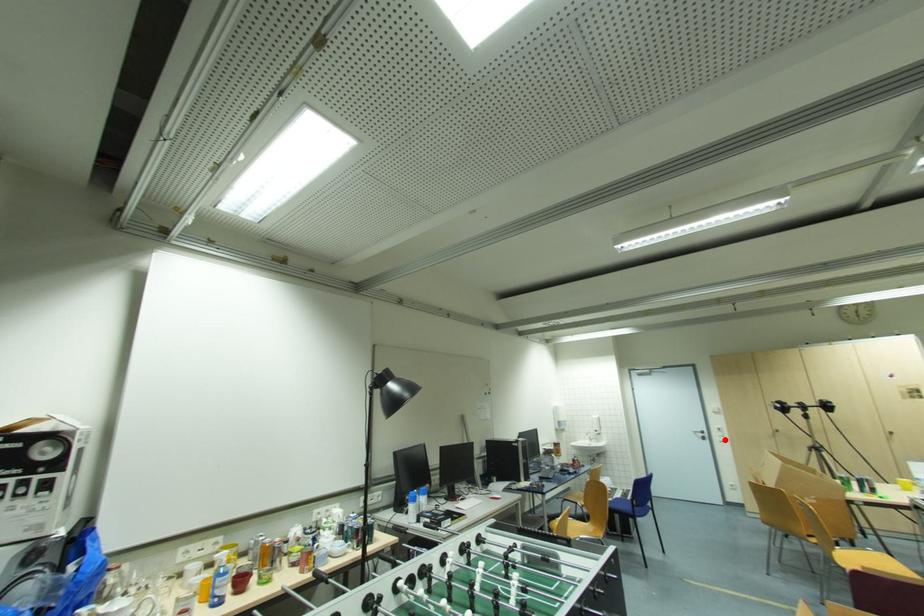
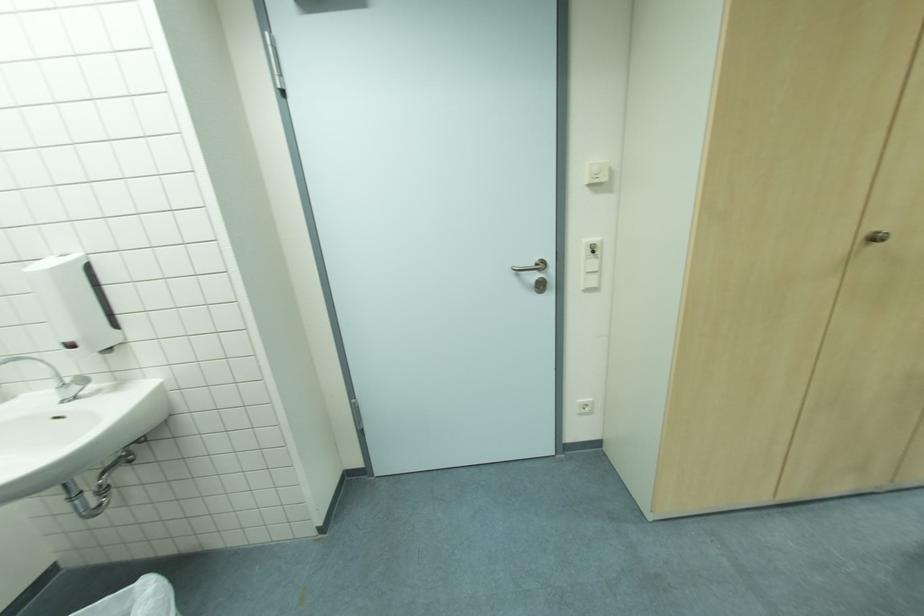
Where in the second image is the point corresponding to the highlighted location from the first image?

(598, 285)